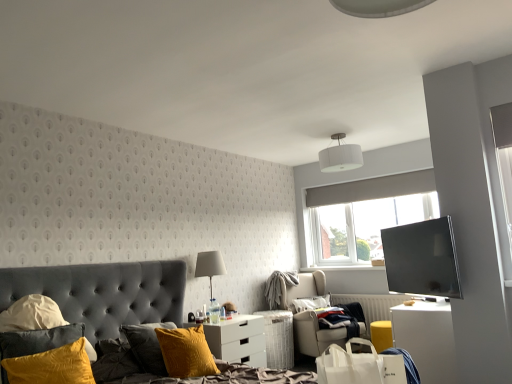
Question: Looking at the image, does white glossy desk at lower right seem bigger or smaller compared to translucent glass bottle at center?

Choices:
 (A) small
 (B) big

Answer: (B)

Question: Visually, is white glossy desk at lower right positioned to the left or to the right of translucent glass bottle at center?

Choices:
 (A) left
 (B) right

Answer: (B)

Question: Based on their relative distances, which object is farther from the velvet yellow pillow at lower left, marked as the 2th pillow in a right-to-left arrangement?

Choices:
 (A) white matte shopping bag at lower right
 (B) white glossy desk at lower right
 (C) white soft pillow at center, which is counted as the 3th pillow, starting from the left
 (D) white glossy nightstand at lower center
 (E) matte black tv at right

Answer: (C)

Question: Estimate the real-world distances between objects in this image. Which object is farther from the white glossy nightstand at lower center?

Choices:
 (A) white matte shopping bag at lower right
 (B) white glossy desk at lower right
 (C) velvet yellow pillow at lower left, the 2th pillow in the left-to-right sequence
 (D) matte white lampshade at center, positioned as the 2th lamp in top-to-bottom order
 (E) matte black tv at right

Answer: (A)